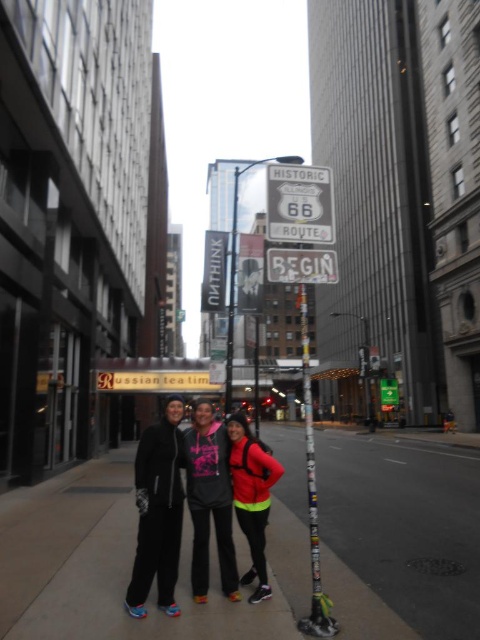
Question: Among these objects, which one is nearest to the camera?

Choices:
 (A) black matte jacket at center
 (B) matte black jacket at center
 (C) neon yellow fabric jacket at center

Answer: (B)

Question: Does black matte jacket at center appear on the right side of metallic silver sign at center?

Choices:
 (A) yes
 (B) no

Answer: (B)

Question: Can you confirm if matte black jacket at center is positioned below metallic silver sign at center?

Choices:
 (A) no
 (B) yes

Answer: (B)

Question: Which object is farther from the camera taking this photo?

Choices:
 (A) metallic silver sign at center
 (B) black fleece jacket at center
 (C) smooth concrete sidewalk at center

Answer: (A)

Question: Which of the following is the farthest from the observer?

Choices:
 (A) black fleece jacket at center
 (B) metallic silver sign at center
 (C) matte black jacket at center
 (D) black matte jacket at center

Answer: (D)

Question: Can you confirm if smooth concrete sidewalk at center is wider than white plastic begin sign at center?

Choices:
 (A) yes
 (B) no

Answer: (A)